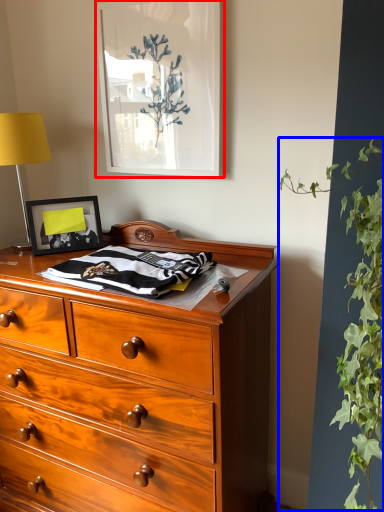
Question: Which object is further to the camera taking this photo, picture frame (highlighted by a red box) or vegetation (highlighted by a blue box)?

Choices:
 (A) picture frame
 (B) vegetation

Answer: (A)